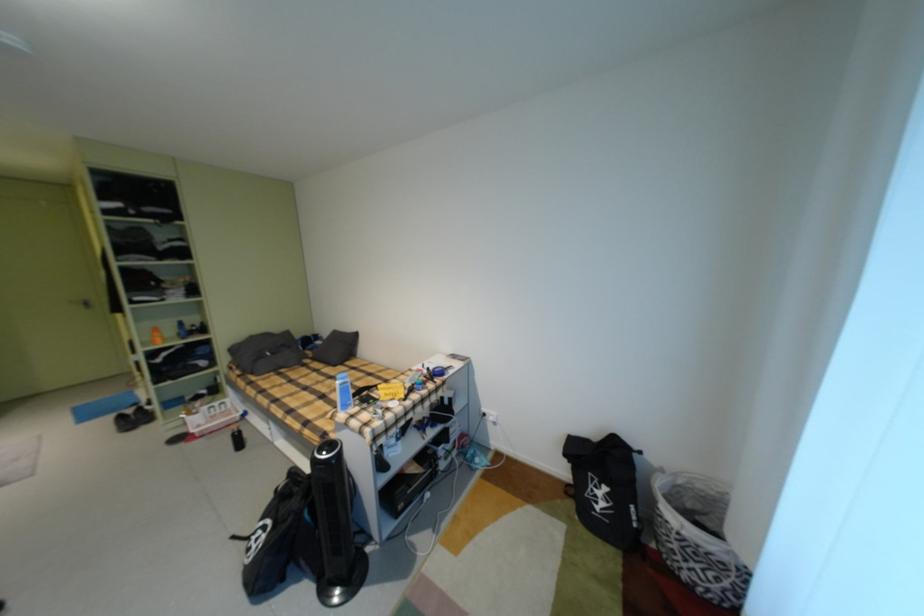
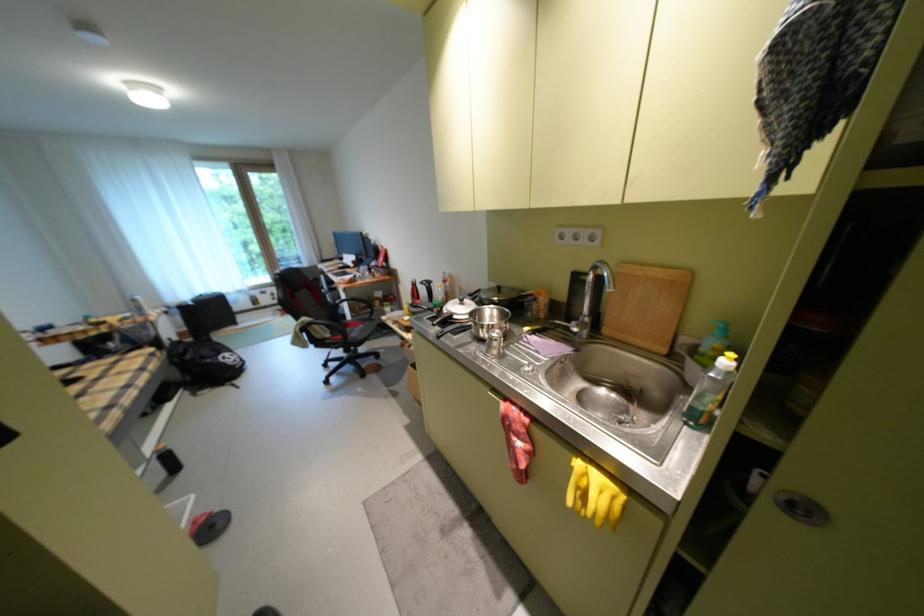
In the second image, find the point that corresponds to point (269, 544) in the first image.

(239, 358)